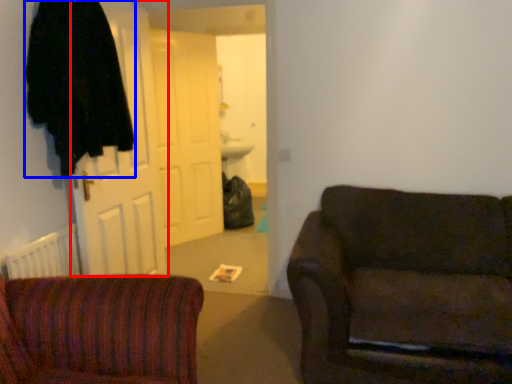
Question: Which object appears farthest to the camera in this image, door (highlighted by a red box) or robe (highlighted by a blue box)?

Choices:
 (A) door
 (B) robe

Answer: (A)